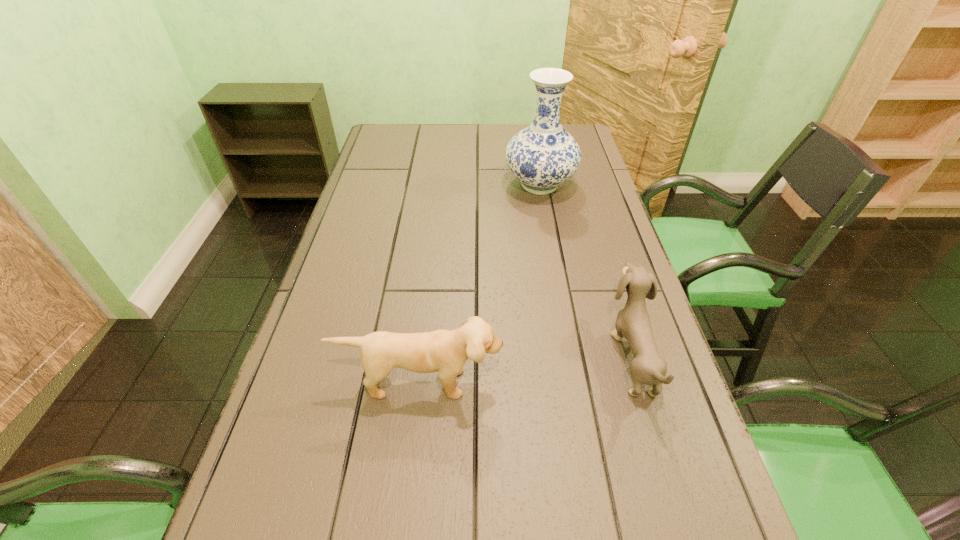
Find the location of a particular element. vase located at the right edge is located at coordinates (542, 156).

At what (x,y) coordinates should I click in order to perform the action: click on puppy present at the right edge. Please return your answer as a coordinate pair (x, y). Looking at the image, I should click on (633, 322).

The width and height of the screenshot is (960, 540). In the image, there is a desktop. Identify the location of vacant space at the far edge. (456, 154).

You are a GUI agent. You are given a task and a screenshot of the screen. Output one action in this format:
    pyautogui.click(x=<x>, y=<y>)
    Task: Click on the free spot at the left edge of the desktop
    This screenshot has height=540, width=960.
    Given the screenshot: What is the action you would take?
    pyautogui.click(x=349, y=349)

This screenshot has width=960, height=540. I want to click on vacant space at the right edge of the desktop, so click(579, 241).

Identify the location of vacant space at the far left corner. (406, 127).

I want to click on vacant area between the left puppy and the right puppy, so click(x=525, y=369).

Where is `vacant area that lies between the tallest object and the right puppy`? The image size is (960, 540). vacant area that lies between the tallest object and the right puppy is located at coordinates (586, 271).

Locate an element on the screen. The width and height of the screenshot is (960, 540). empty location between the right puppy and the tallest object is located at coordinates (586, 271).

Where is `empty location between the right puppy and the tallest object`? empty location between the right puppy and the tallest object is located at coordinates (586, 271).